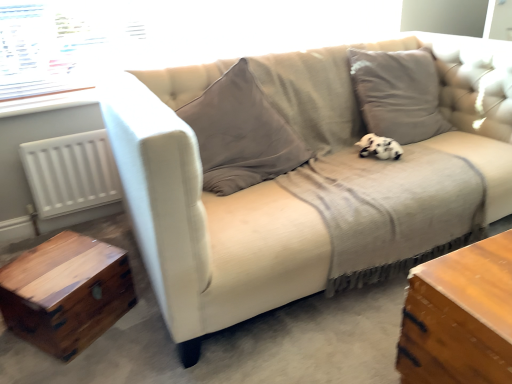
Locate an element on the screen. empty space that is to the right of wooden trunk at lower left is located at coordinates (139, 332).